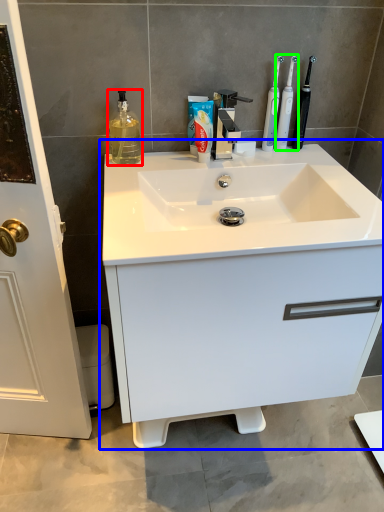
Question: Which object is positioned farthest from cleaning product (highlighted by a red box)? Select from bathroom cabinet (highlighted by a blue box) and toothbrush (highlighted by a green box).

Choices:
 (A) bathroom cabinet
 (B) toothbrush

Answer: (A)